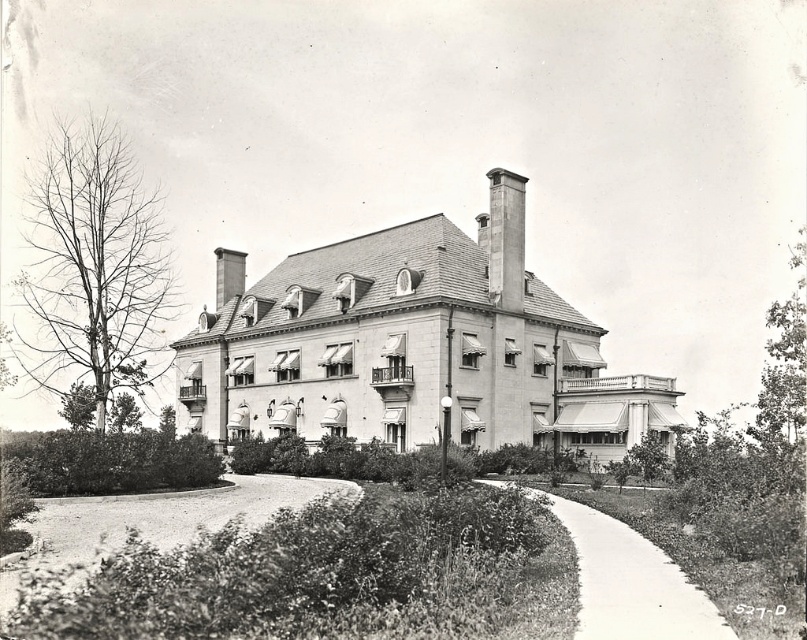
Can you confirm if smooth concrete path at lower center is positioned above smooth stone chimney at upper center?

Actually, smooth concrete path at lower center is below smooth stone chimney at upper center.

Who is taller, smooth concrete path at lower center or smooth stone chimney at upper center?

With more height is smooth stone chimney at upper center.

Is point (590, 524) more distant than point (500, 262)?

That is False.

I want to click on smooth concrete path at lower center, so click(x=630, y=582).